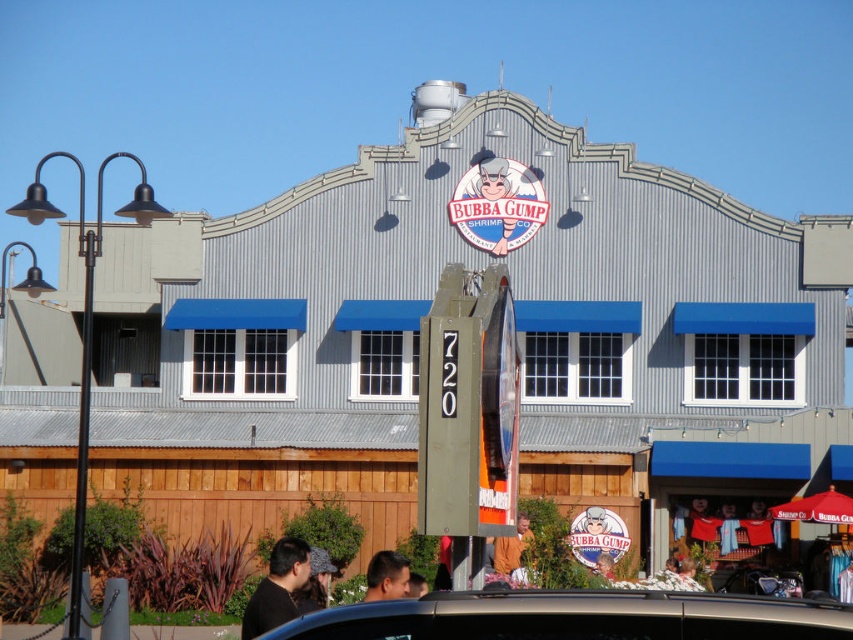
Question: Which of the following is the farthest from the observer?

Choices:
 (A) dark brown leather hat at center
 (B) orange fabric at center
 (C) matte plastic sign at center
 (D) smooth black hair at center

Answer: (C)

Question: Is black matte shirt at lower left closer to the viewer compared to matte plastic sign at center?

Choices:
 (A) no
 (B) yes

Answer: (B)

Question: Which of the following is the closest to the observer?

Choices:
 (A) matte plastic sign at center
 (B) smooth skin face at center
 (C) orange fabric at center

Answer: (B)

Question: Does metallic gray car at lower center have a lesser width compared to smooth black hair at center?

Choices:
 (A) yes
 (B) no

Answer: (B)

Question: Among these points, which one is farthest from the camera?

Choices:
 (A) (320, 593)
 (B) (604, 557)
 (C) (361, 616)
 (D) (401, 592)

Answer: (B)

Question: Can you confirm if smooth black hair at center is smaller than matte plastic sign at center?

Choices:
 (A) yes
 (B) no

Answer: (B)